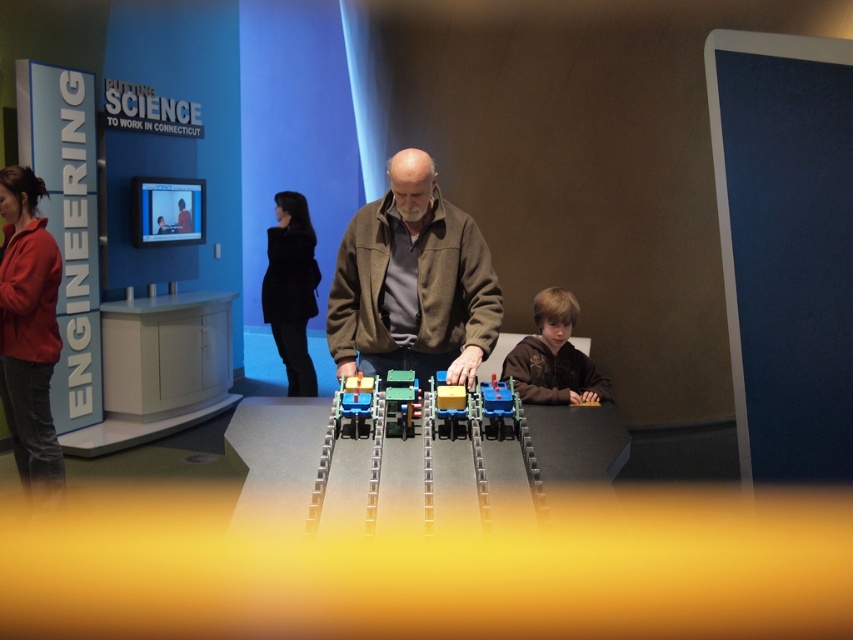
You are a visitor at the museum and want to take a photo of the blue plastic toy car at center without blocking the exhibit text on the wall. Since the brown matte jacket at center is in the way, which direction should you move to get a clear shot?

The brown matte jacket at center is to the left of the blue plastic toy car at center. To avoid blocking the exhibit text, move to the right side of the blue plastic toy car at center so the jacket is no longer in front of the car.

You are a museum visitor who wants to place a 20 cm long model airplane between the translucent plastic train car at center and the matte plastic toy at center. Can the model airplane fit in the space between them without overlapping either object?

The distance between the translucent plastic train car at center and the matte plastic toy at center is 22.57 centimeters. Since the model airplane is 20 cm long, it can fit in the space between them without overlapping either object.

Based on the photo, you are a visitor at the museum and want to take a photo of the blue plastic toy car at center without blocking it with the brown matte jacket at center. Is the jacket likely blocking your view of the car?

The brown matte jacket at center is much taller than the blue plastic toy car at center, so it could block your view of the car if positioned directly in front of it.